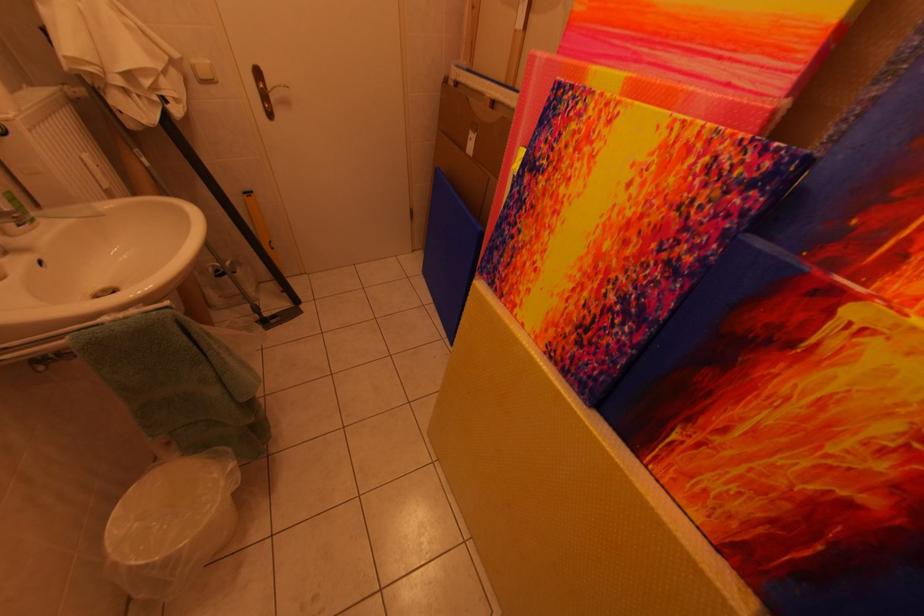
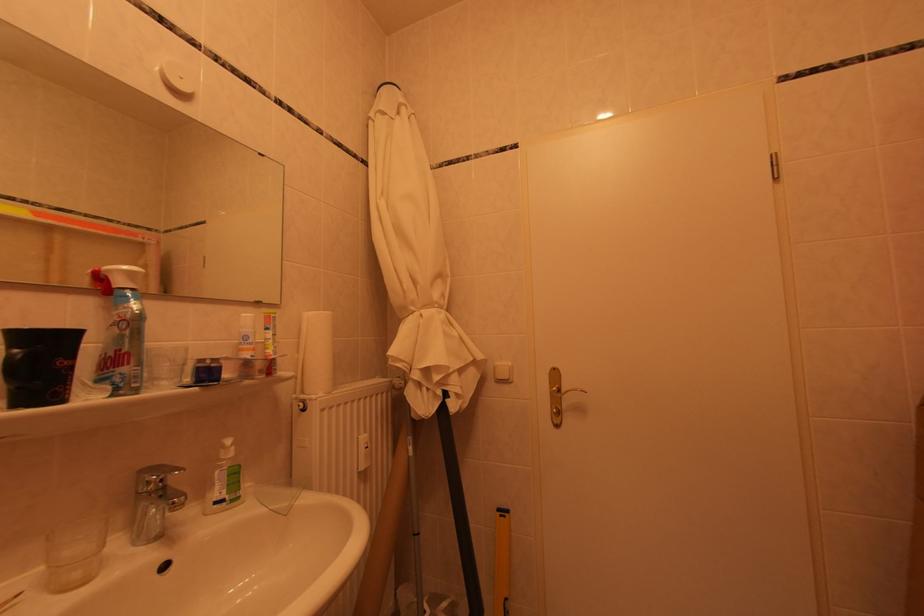
The first image is from the beginning of the video and the second image is from the end. How did the camera likely rotate when shooting the video?

The rotation direction of the camera is left-up.